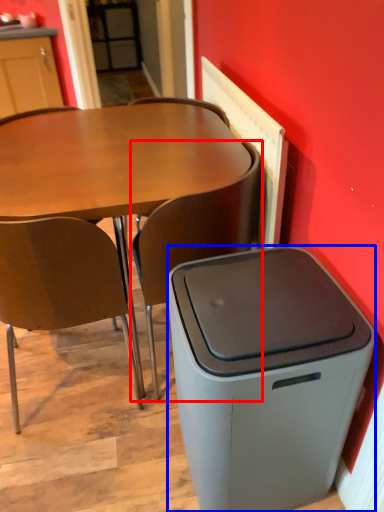
Question: Which object appears closest to the camera in this image, chair (highlighted by a red box) or trash bin/can (highlighted by a blue box)?

Choices:
 (A) chair
 (B) trash bin/can

Answer: (B)